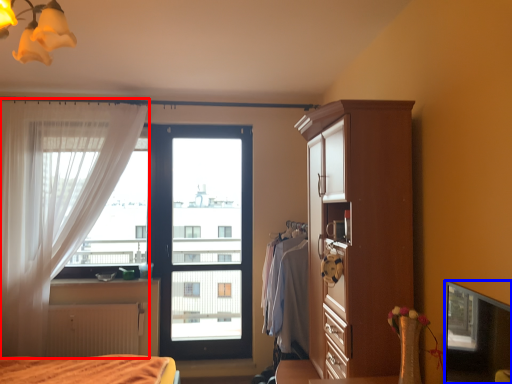
Question: Which object is closer to the camera taking this photo, curtain (highlighted by a red box) or window screen (highlighted by a blue box)?

Choices:
 (A) curtain
 (B) window screen

Answer: (B)